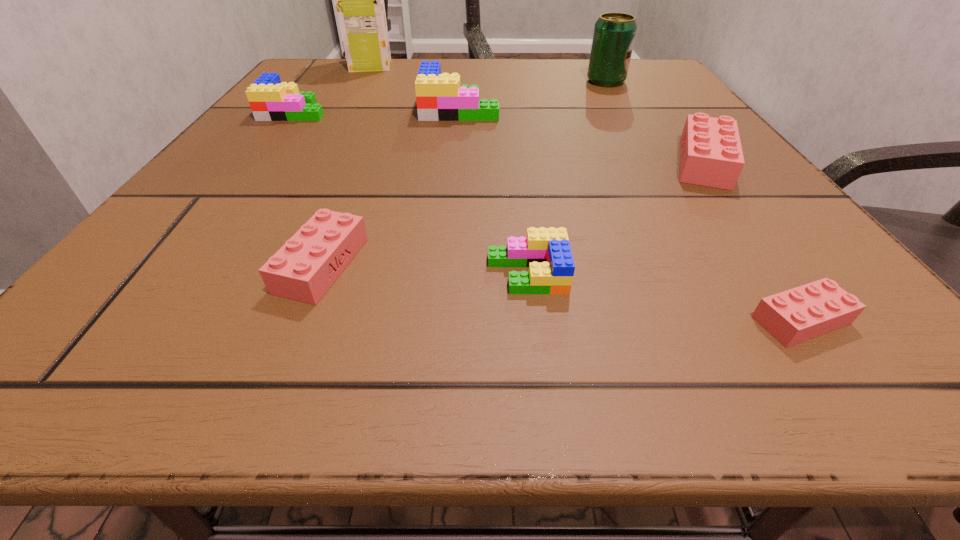
Locate an element on the screen. This screenshot has width=960, height=540. free region located 0.100m on the front of the nearest green Lego is located at coordinates (538, 369).

Locate an element on the screen. vacant space situated on the back of the second smallest pink Lego is located at coordinates (358, 173).

At what (x,y) coordinates should I click in order to perform the action: click on vacant space located 0.080m on the back of the shortest Lego. Please return your answer as a coordinate pair (x, y). The width and height of the screenshot is (960, 540). Looking at the image, I should click on (751, 249).

Find the location of a particular element. The image size is (960, 540). soya milk that is at the far edge is located at coordinates (359, 0).

You are a GUI agent. You are given a task and a screenshot of the screen. Output one action in this format:
    pyautogui.click(x=<x>, y=<y>)
    Task: Click on the beer can at the far edge
    
    Given the screenshot: What is the action you would take?
    pyautogui.click(x=614, y=34)

Locate an element on the screen. object that is at the near edge is located at coordinates (802, 313).

At what (x,y) coordinates should I click in order to perform the action: click on soya milk present at the left edge. Please return your answer as a coordinate pair (x, y). Looking at the image, I should click on (359, 0).

Identify the location of Lego present at the left edge. (270, 100).

Locate an element on the screen. The height and width of the screenshot is (540, 960). beer can that is at the right edge is located at coordinates (614, 34).

Image resolution: width=960 pixels, height=540 pixels. I want to click on object that is positioned at the far left corner, so click(x=359, y=0).